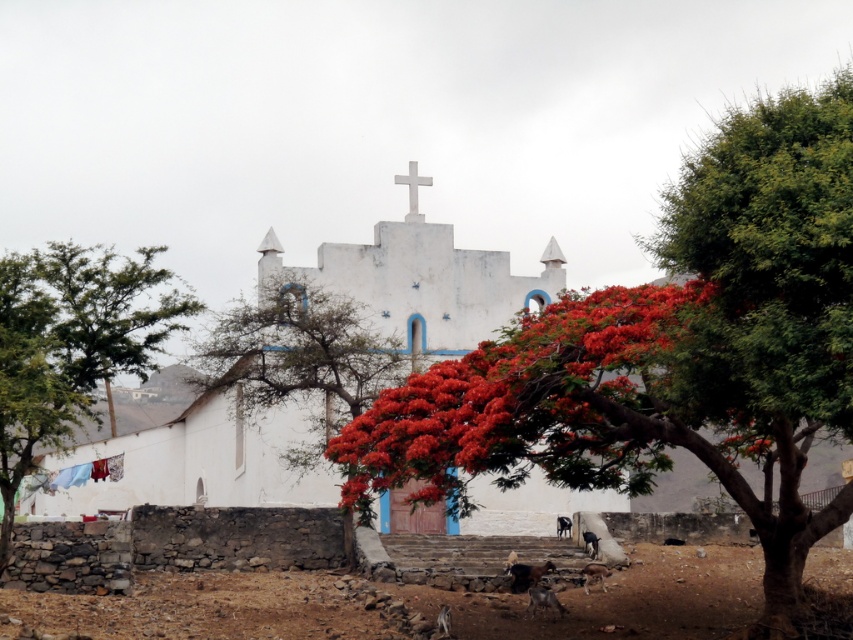
You are standing in front of the church and notice the bright red leaves at center and the green leafy tree at left. Which object is closer to you?

The bright red leaves at center is positioned under green leafy tree at left, so the bright red leaves at center is closer to you than the green leafy tree at left.

Looking at this image, you are standing in the rural scene and want to take a photo of the bright red leaves at center and the green leafy tree at left. Which object is positioned closer to you?

The bright red leaves at center is closer to the viewer than the green leafy tree at left.

You are standing at the center of the image and want to walk towards the red leafy tree at center. Which direction should you move?

Since the red leafy tree at center is located at point (669, 352), you should move towards the lower part of the image to reach it.